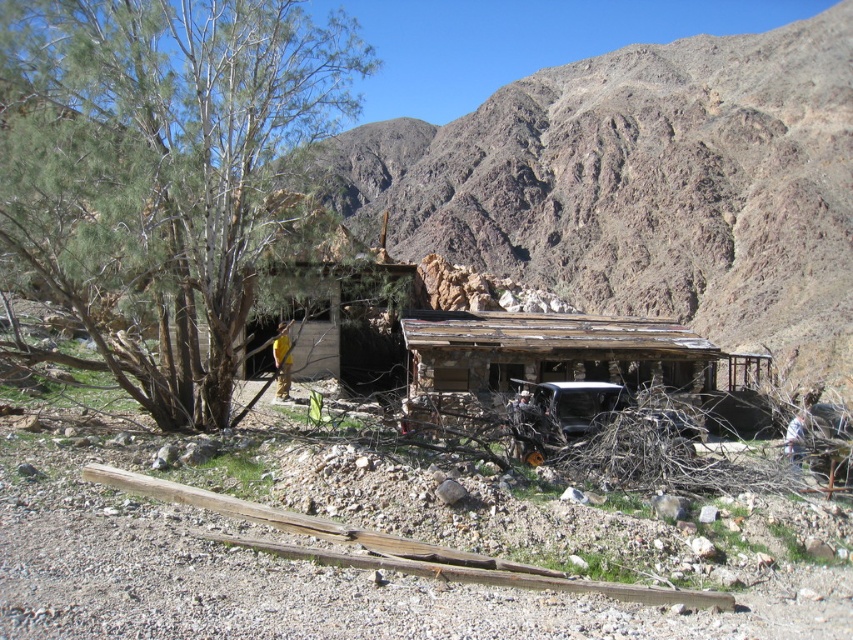
Is point (844, 90) closer to viewer compared to point (495, 364)?

No, (844, 90) is further to viewer.

Between point (440, 241) and point (712, 352), which one is positioned in front?

Point (712, 352)

Identify the location of rusty wood shack at center. Image resolution: width=853 pixels, height=640 pixels. (645, 186).

Based on the photo, is green leafy tree at left bigger than weathered wood hut at center?

No, green leafy tree at left is not bigger than weathered wood hut at center.

Describe the element at coordinates (161, 164) in the screenshot. I see `green leafy tree at left` at that location.

Measure the distance between green leafy tree at left and camera.

green leafy tree at left is 98.25 feet away from camera.

Find the location of `green leafy tree at left`. green leafy tree at left is located at coordinates (161, 164).

Does rusty wood shack at center appear over green leafy tree at left?

Correct, rusty wood shack at center is located above green leafy tree at left.

Between rusty wood shack at center and green leafy tree at left, which one has less height?

With less height is green leafy tree at left.

Is point (495, 184) positioned behind point (167, 308)?

Yes, point (495, 184) is behind point (167, 308).

The height and width of the screenshot is (640, 853). Find the location of `rusty wood shack at center`. rusty wood shack at center is located at coordinates (645, 186).